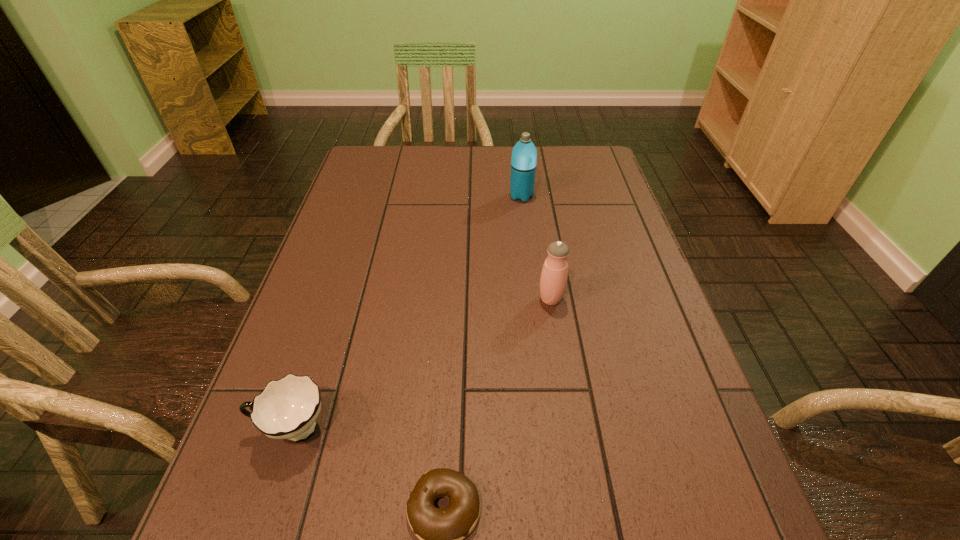
Identify the location of the tallest object. (524, 154).

This screenshot has width=960, height=540. What are the coordinates of `the taller thermos bottle` in the screenshot? It's located at (524, 154).

Image resolution: width=960 pixels, height=540 pixels. I want to click on the third nearest object, so click(x=553, y=280).

Where is `the nearer thermos bottle`? Image resolution: width=960 pixels, height=540 pixels. the nearer thermos bottle is located at coordinates (553, 280).

You are a GUI agent. You are given a task and a screenshot of the screen. Output one action in this format:
    pyautogui.click(x=<x>, y=<y>)
    Task: Click on the third farthest object
    
    Given the screenshot: What is the action you would take?
    pyautogui.click(x=287, y=408)

At what (x,y) coordinates should I click in order to perform the action: click on cup. Please return your answer as a coordinate pair (x, y). The height and width of the screenshot is (540, 960). Looking at the image, I should click on (287, 408).

This screenshot has height=540, width=960. What are the coordinates of `vacant area situated on the left of the taller thermos bottle` in the screenshot? It's located at (446, 196).

The image size is (960, 540). I want to click on vacant space located 0.340m on the left of the nearer thermos bottle, so click(x=392, y=299).

At what (x,y) coordinates should I click in order to perform the action: click on object that is positioned at the left edge. Please return your answer as a coordinate pair (x, y). Looking at the image, I should click on (287, 408).

I want to click on vacant space at the far edge of the desktop, so (x=440, y=164).